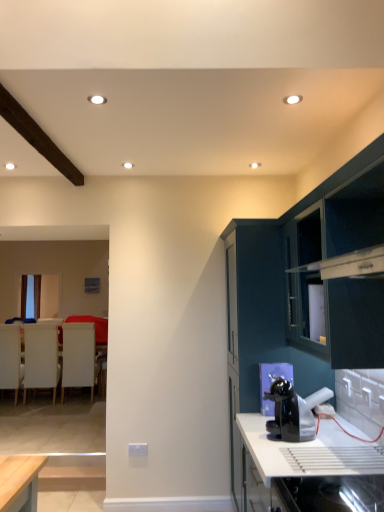
Question: From the image's perspective, is white glossy countertop at lower right above or below glossy dark teal cabinet at right, which appears as the 1th cabinetry when viewed from the back?

Choices:
 (A) below
 (B) above

Answer: (A)

Question: In terms of size, does white glossy countertop at lower right appear bigger or smaller than glossy dark teal cabinet at right, which appears as the 1th cabinetry when viewed from the back?

Choices:
 (A) small
 (B) big

Answer: (A)

Question: Estimate the real-world distances between objects in this image. Which object is closer to the white fabric armchair at left, the 1th armchair in the left-to-right sequence?

Choices:
 (A) white matte armchair at left, the 2th armchair positioned from the right
 (B) white fabric armchair at left, acting as the 3th armchair starting from the left
 (C) white glossy countertop at lower right
 (D) dark green cabinet at upper right, which is counted as the 1th cabinetry, starting from the front
 (E) black glossy coffee machine at lower center

Answer: (A)

Question: Considering the real-world distances, which object is closest to the glossy dark teal cabinet at right, marked as the second cabinetry in a front-to-back arrangement?

Choices:
 (A) white glossy countertop at lower right
 (B) white fabric armchair at left, which is counted as the 3th armchair, starting from the right
 (C) white matte armchair at left, the 2th armchair positioned from the right
 (D) white fabric armchair at left, the 1th armchair when ordered from right to left
 (E) black glossy coffee machine at lower center

Answer: (E)